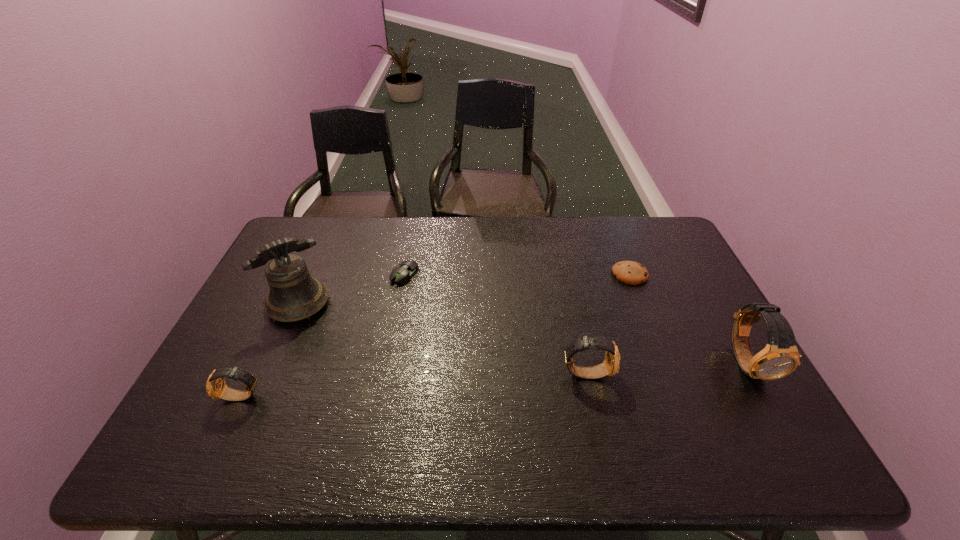
Identify the location of vacant spot for a new watch to ensure equal spacing. The width and height of the screenshot is (960, 540). (418, 385).